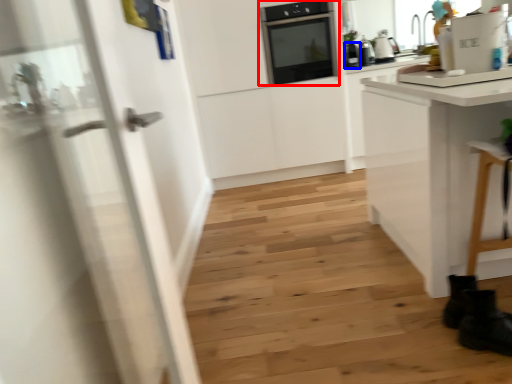
Question: Which object appears closest to the camera in this image, home appliance (highlighted by a red box) or kitchen appliance (highlighted by a blue box)?

Choices:
 (A) home appliance
 (B) kitchen appliance

Answer: (A)